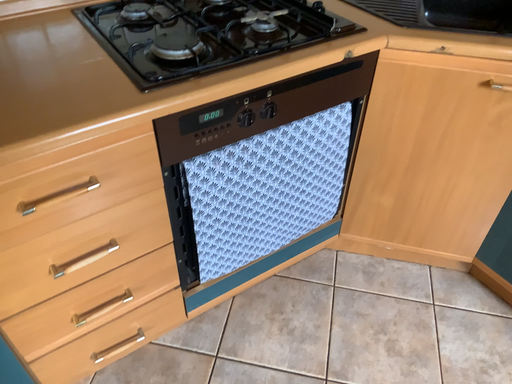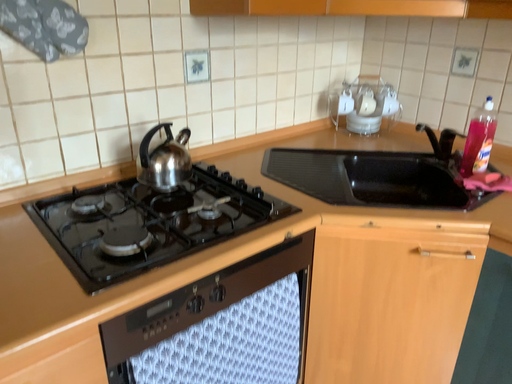
Question: How did the camera likely rotate when shooting the video?

Choices:
 (A) rotated upward
 (B) rotated downward

Answer: (A)